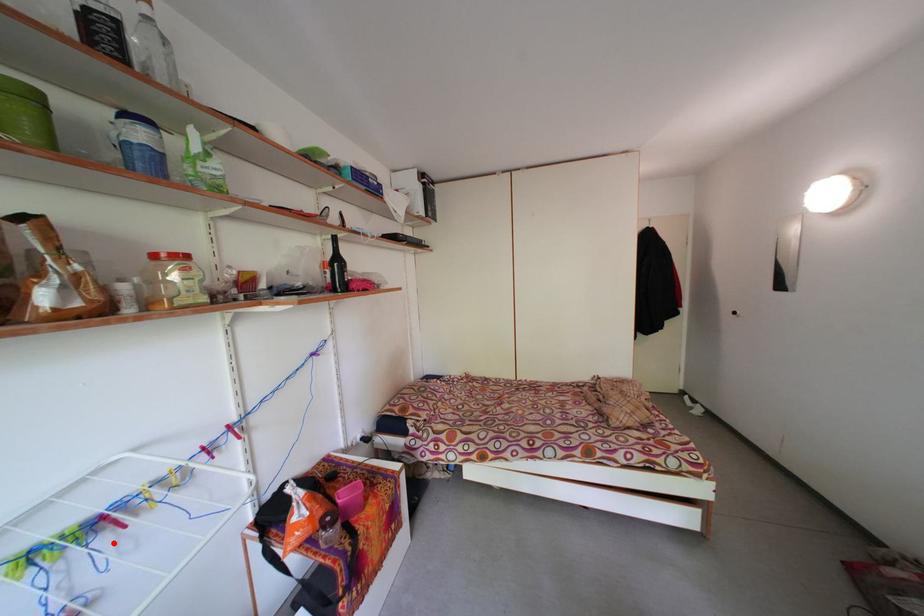
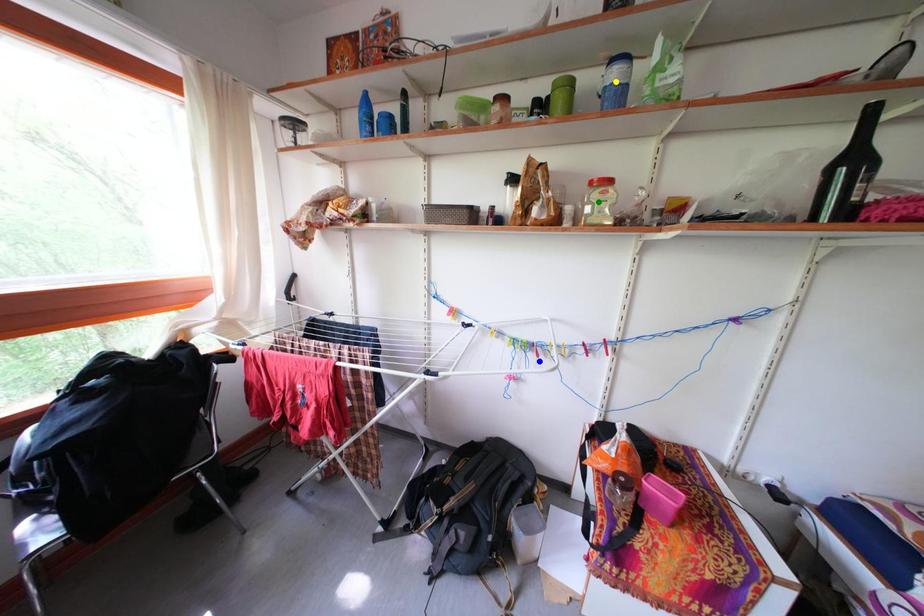
Question: I am providing you with two images of the same scene from different viewpoints. A red point is marked on the first image. You are given multiple points on the second image. Which mark in image 2 goes with the point in image 1?

Choices:
 (A) yellow point
 (B) blue point
 (C) green point

Answer: (B)